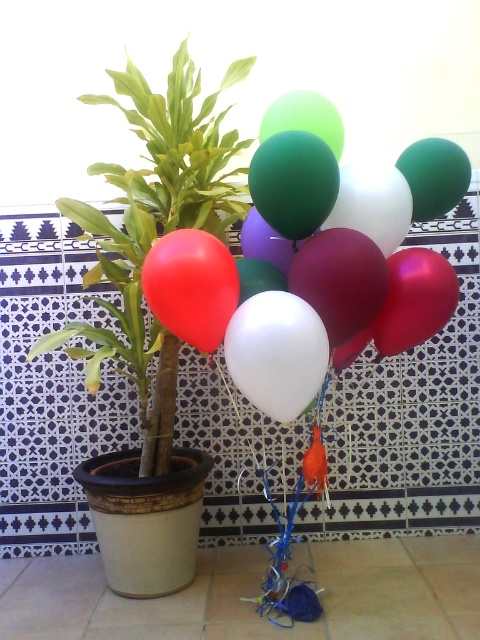
Does green matte plant at left appear on the right side of matte red balloon at left?

In fact, green matte plant at left is to the left of matte red balloon at left.

Is green matte plant at left thinner than matte red balloon at left?

Incorrect, green matte plant at left's width is not less than matte red balloon at left's.

Is point (226, 134) less distant than point (189, 285)?

That is False.

This screenshot has height=640, width=480. Identify the location of green matte plant at left. (155, 227).

Can you confirm if matte white balloon at center is positioned above green matte plant at left?

Indeed, matte white balloon at center is positioned over green matte plant at left.

Does point (291, 380) come closer to viewer compared to point (106, 246)?

Yes, it is in front of point (106, 246).

I want to click on matte white balloon at center, so click(x=313, y=262).

Between point (262, 355) and point (159, 250), which one is positioned in front?

Point (262, 355)

The width and height of the screenshot is (480, 640). Find the location of `matte white balloon at center`. matte white balloon at center is located at coordinates (313, 262).

Does point (358, 316) come farther from viewer compared to point (216, 348)?

No, it is not.

Find the location of a particular element. The image size is (480, 640). matte white balloon at center is located at coordinates (313, 262).